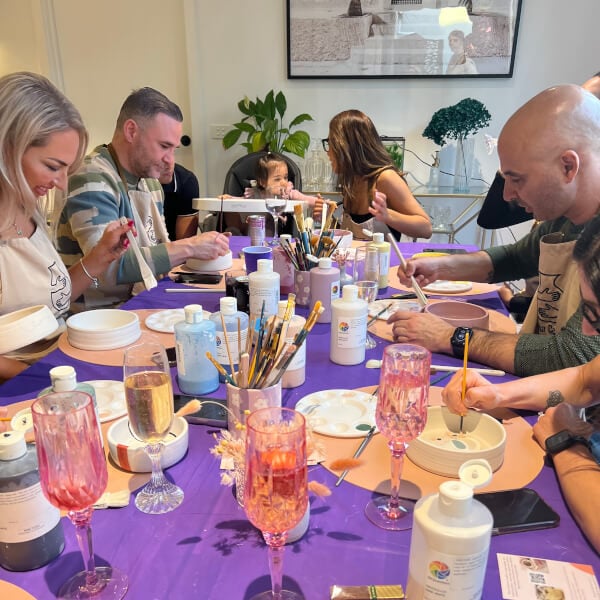
At what (x,y) coordinates should I click in order to perform the action: click on purple tablecloth. Please return your answer as a coordinate pair (x, y). This screenshot has height=600, width=600. Looking at the image, I should click on (173, 545).